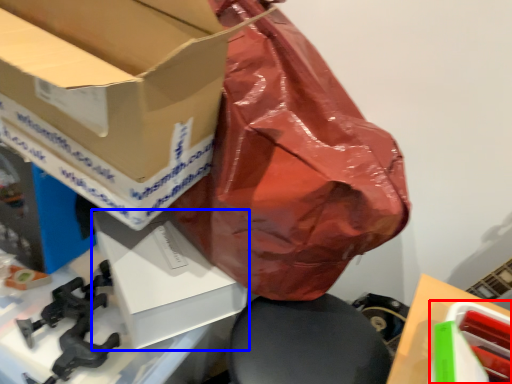
Question: Which of the following is the closest to the observer, box (highlighted by a red box) or box (highlighted by a blue box)?

Choices:
 (A) box
 (B) box

Answer: (A)